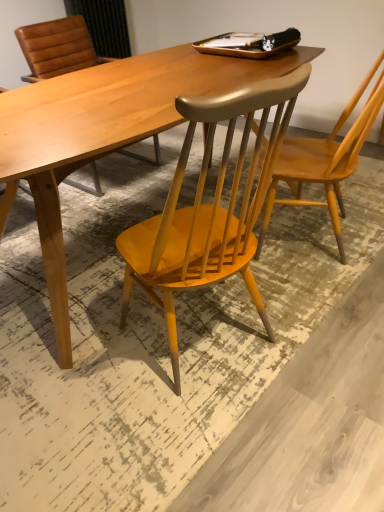
Question: From their relative heights in the image, would you say wooden chair at center, which is the second chair in right-to-left order, is taller or shorter than light brown wood chair at upper right, the second chair from the left?

Choices:
 (A) tall
 (B) short

Answer: (B)

Question: From the image's perspective, is wooden chair at center, which is the second chair in right-to-left order, located above or below light brown wood chair at upper right, the second chair from the left?

Choices:
 (A) above
 (B) below

Answer: (B)

Question: Considering their positions, is wooden chair at center, which is the second chair in right-to-left order, located in front of or behind light brown wood chair at upper right, arranged as the 1th chair when viewed from the right?

Choices:
 (A) behind
 (B) front

Answer: (B)

Question: From their relative heights in the image, would you say light brown wood chair at upper right, arranged as the 1th chair when viewed from the right, is taller or shorter than wooden chair at center, which is the second chair in right-to-left order?

Choices:
 (A) tall
 (B) short

Answer: (A)

Question: Is light brown wood chair at upper right, the second chair from the left, in front of or behind wooden chair at center, which is the second chair in right-to-left order, in the image?

Choices:
 (A) behind
 (B) front

Answer: (A)

Question: Considering the positions of point (372, 74) and point (244, 208), is point (372, 74) closer or farther from the camera than point (244, 208)?

Choices:
 (A) closer
 (B) farther

Answer: (B)

Question: Considering the positions of light brown wood chair at upper right, arranged as the 1th chair when viewed from the right, and wooden chair at center, which appears as the first chair when viewed from the left, in the image, is light brown wood chair at upper right, arranged as the 1th chair when viewed from the right, wider or thinner than wooden chair at center, which appears as the first chair when viewed from the left,?

Choices:
 (A) thin
 (B) wide

Answer: (A)